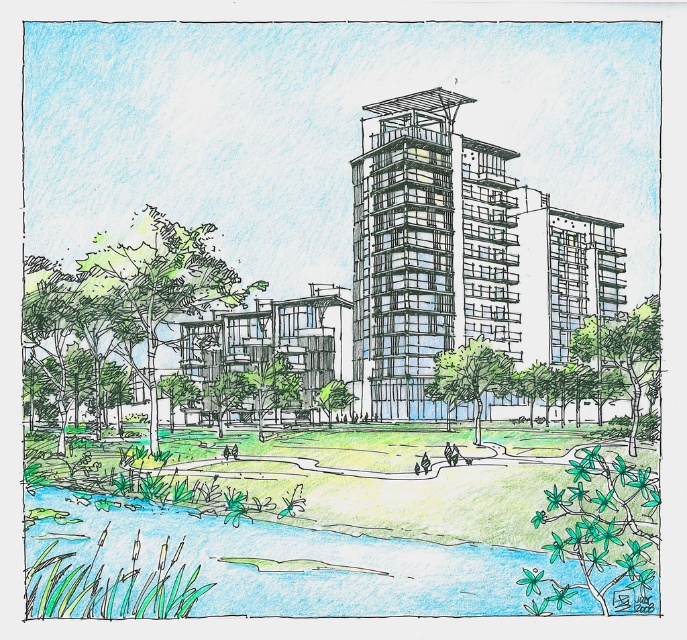
Can you confirm if transparent glass building at center is positioned above transparent glass tower at center?

Incorrect, transparent glass building at center is not positioned above transparent glass tower at center.

This screenshot has height=640, width=687. What do you see at coordinates (460, 257) in the screenshot?
I see `transparent glass building at center` at bounding box center [460, 257].

Locate an element on the screen. transparent glass building at center is located at coordinates (460, 257).

Is point (449, 104) behind point (357, 604)?

Yes, it is.

Find the location of a particular element. transparent glass building at center is located at coordinates (460, 257).

I want to click on transparent glass building at center, so click(460, 257).

Find the location of a particular element. The image size is (687, 640). transparent glass building at center is located at coordinates (460, 257).

Who is more distant from viewer, (174,609) or (427,262)?

Positioned behind is point (427,262).

Does point (203, 589) lie behind point (394, 292)?

No.

Is point (256, 611) less distant than point (361, 392)?

Yes.

You are a GUI agent. You are given a task and a screenshot of the screen. Output one action in this format:
    pyautogui.click(x=<x>, y=<y>)
    Task: Click on the blue-green water at lower center
    The height and width of the screenshot is (640, 687).
    Given the screenshot: What is the action you would take?
    pyautogui.click(x=286, y=568)